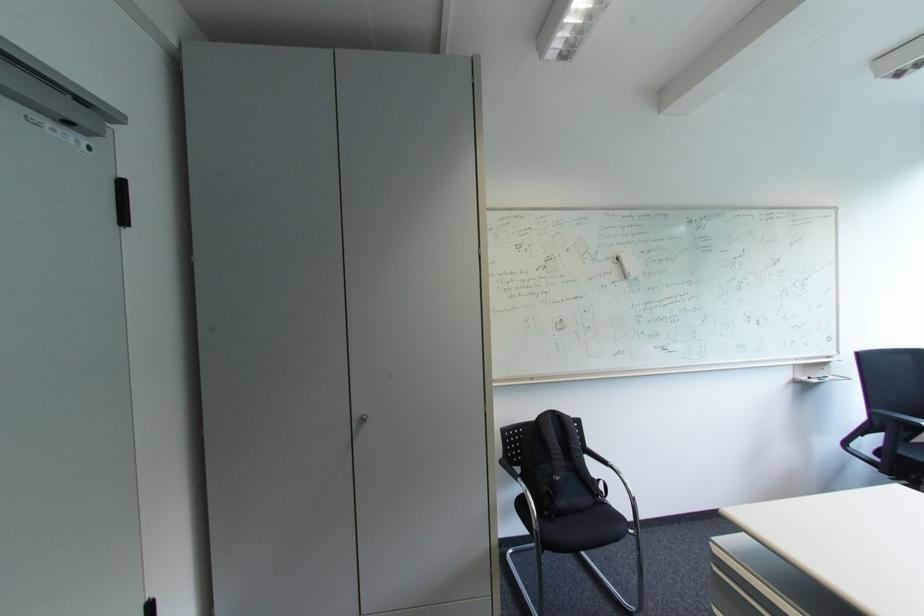
Which object does [556,466] point to?

This point indicates the black backpack.